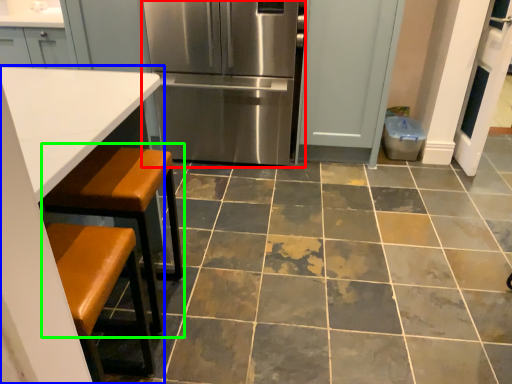
Question: Which object is the farthest from refrigerator (highlighted by a red box)? Choose among these: table (highlighted by a blue box) or step stool (highlighted by a green box).

Choices:
 (A) table
 (B) step stool

Answer: (A)